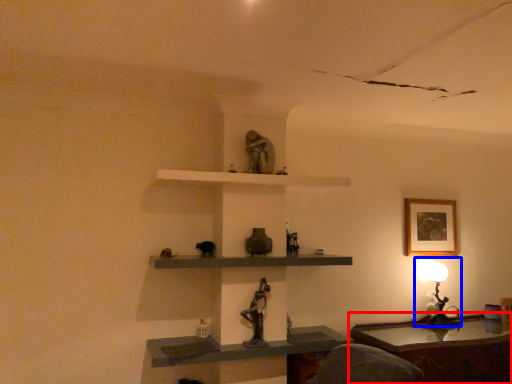
Question: Which object is further to the camera taking this photo, table (highlighted by a red box) or table lamp (highlighted by a blue box)?

Choices:
 (A) table
 (B) table lamp

Answer: (B)